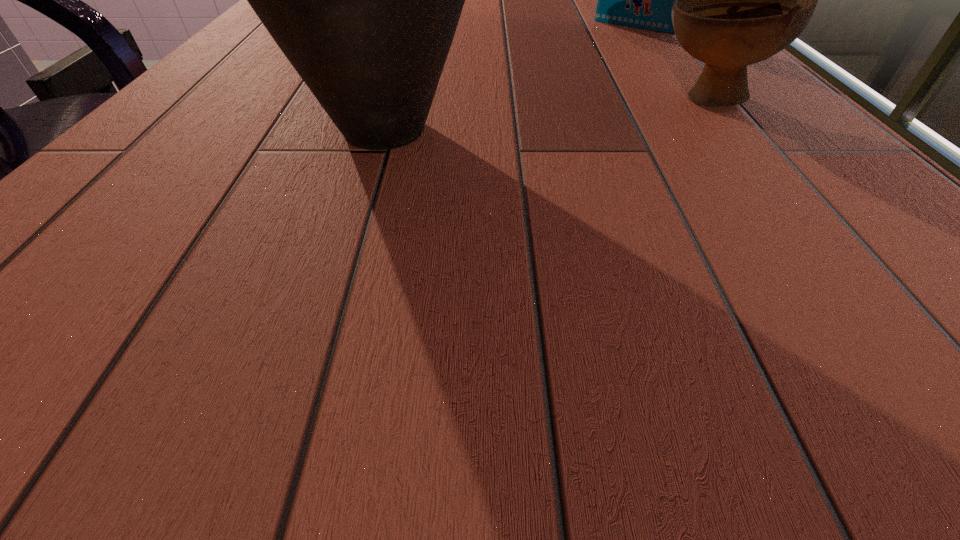
Locate an element on the screen. The width and height of the screenshot is (960, 540). the tallest object is located at coordinates (364, 0).

What are the coordinates of `urn` in the screenshot? It's located at (364, 0).

Where is `soup bowl`? This screenshot has height=540, width=960. soup bowl is located at coordinates coord(740,0).

The image size is (960, 540). I want to click on book, so click(644, 0).

Where is `the farthest object`? The image size is (960, 540). the farthest object is located at coordinates (644, 0).

In order to click on vacant area situated 0.100m on the front of the tallest object in this screenshot , I will do `click(347, 251)`.

The image size is (960, 540). In order to click on free space located on the front of the soup bowl in this screenshot , I will do `click(829, 251)`.

What are the coordinates of `vacant space located on the front cover of the farthest object` in the screenshot? It's located at (612, 41).

Locate an element on the screen. free point located 0.170m on the front cover of the farthest object is located at coordinates (588, 62).

Locate an element on the screen. The image size is (960, 540). free space located 0.280m on the front cover of the farthest object is located at coordinates (563, 84).